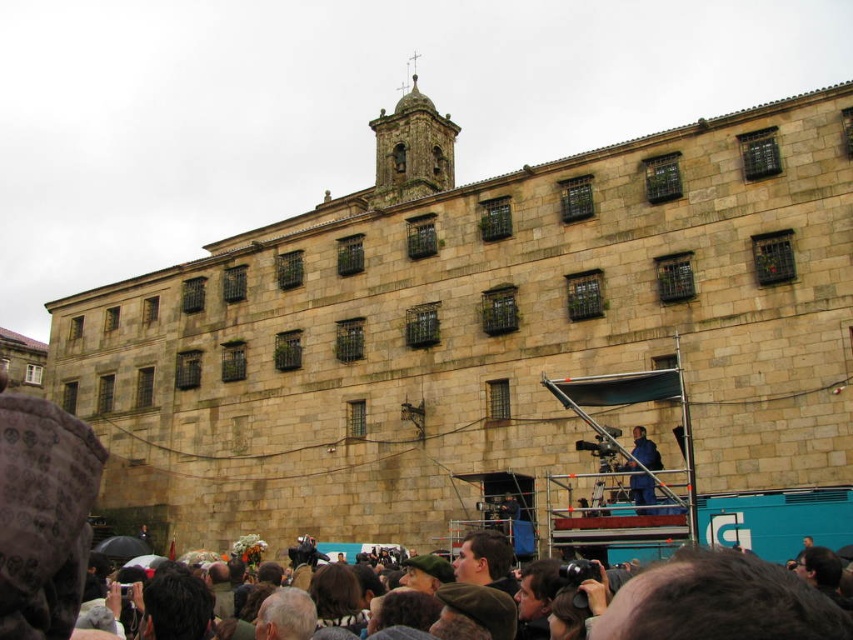
You are a photographer standing at the blue fabric at center. You want to take a photo of the dark brown stone tower at upper center. If your camera has a maximum zoom range of 40 meters, will you be able to capture the tower clearly without moving closer?

The distance between the dark brown stone tower at upper center and the blue fabric at center is 42.35 meters. Since the camera can only zoom up to 40 meters, you will not be able to capture the tower clearly without moving closer.

You are a photographer standing at the base of the camera crane. You need to capture a photo of the person with dark brown hair at lower center without any obstructions. The camera can focus on objects up to 15 meters away. Can you take the photo from your current position?

The distance between the photographer and the person with dark brown hair at lower center is 14.08 meters, which is within the camera focus range of 15 meters. Therefore, the photographer can take the photo without obstructions.

You are standing at the position of the viewer. There is a person with dark brown hair at lower center. If you want to take a photo of them without using a zoom lens, do you think you can capture their face clearly from your current position?

The dark brown hair at lower center and viewer are 14.08 meters apart from each other. At this distance, capturing a clear facial photo without a zoom lens may be challenging due to the limited focal length, so it is advisable to move closer or use a zoom lens for better clarity.